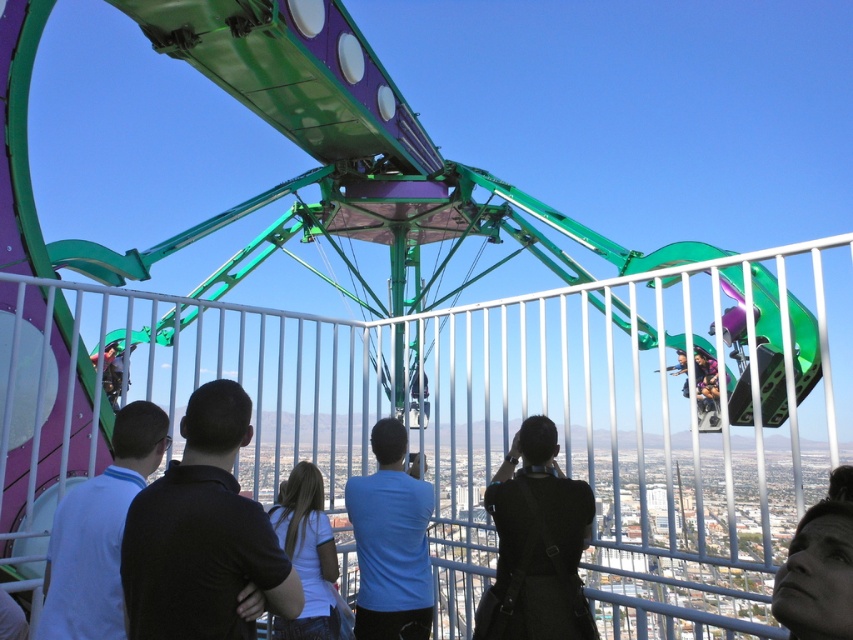
You are standing at the point marked as point (537, 545) in the amusement park scene. What object is located exactly at that coordinate?

The point (537, 545) corresponds to the black fabric camera at center.

You are a photographer trying to capture a clear photo of the amusement park ride. You have a black fabric camera at center and a smooth skin face at lower right in your viewfinder. Which object should you adjust your focus on if you want to ensure the camera is focused on the closer subject?

The smooth skin face at lower right is closer to you than the black fabric camera at center, so you should adjust your focus on the smooth skin face at lower right to ensure the camera is focused on the closer subject.